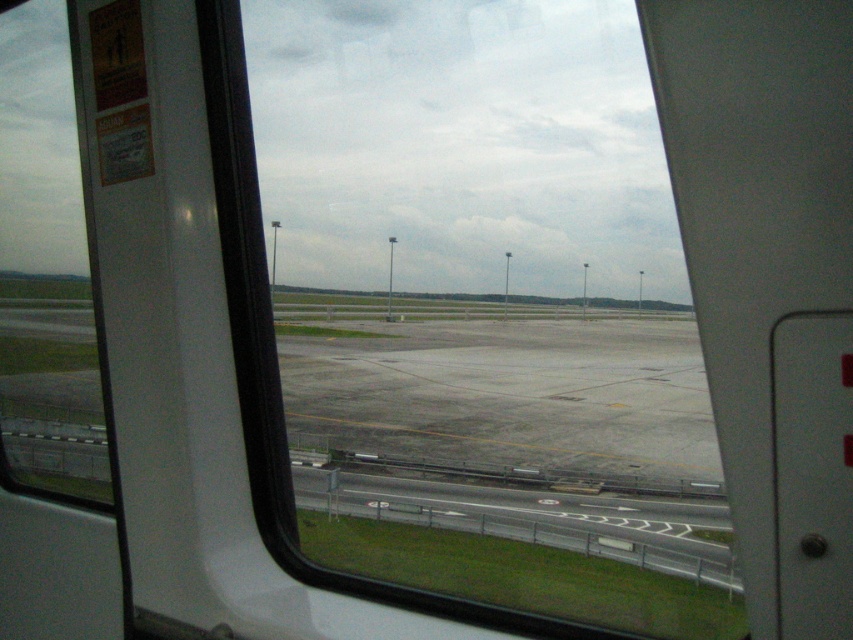
Question: Is transparent glass window at center above transparent glass window at left?

Choices:
 (A) yes
 (B) no

Answer: (B)

Question: In this image, where is transparent glass window at center located relative to transparent glass window at left?

Choices:
 (A) right
 (B) left

Answer: (A)

Question: Which object is farther from the camera taking this photo?

Choices:
 (A) transparent glass window at left
 (B) transparent glass window at center

Answer: (A)

Question: Which object appears farthest from the camera in this image?

Choices:
 (A) transparent glass window at left
 (B) transparent glass window at center

Answer: (A)

Question: Can you confirm if transparent glass window at center is positioned to the left of transparent glass window at left?

Choices:
 (A) yes
 (B) no

Answer: (B)

Question: Which point is closer to the camera?

Choices:
 (A) (10, 113)
 (B) (521, 248)

Answer: (A)